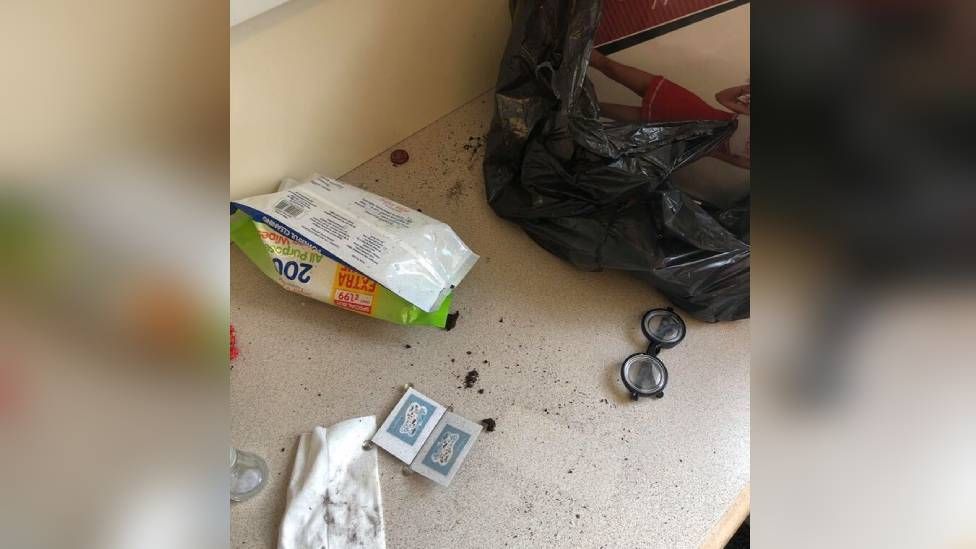
Locate an element on the screen. Image resolution: width=976 pixels, height=549 pixels. countertop edge is located at coordinates (732, 522).